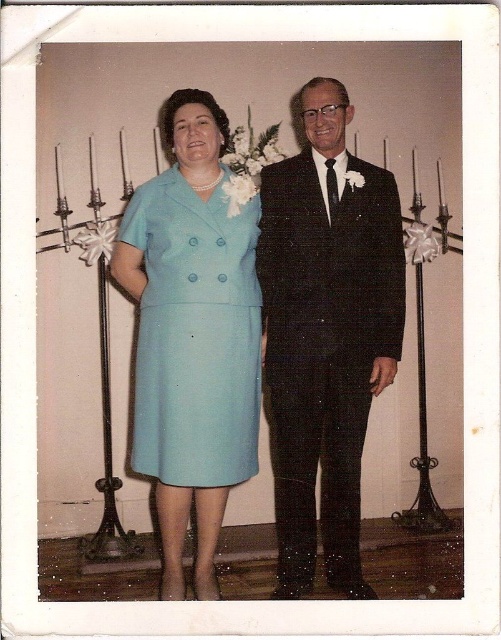
Identify the location of black textured suit at center. The width and height of the screenshot is (501, 640). (326, 333).

Which of these two, black textured suit at center or light blue fabric dress at center, stands shorter?

With less height is light blue fabric dress at center.

Which is in front, point (402, 320) or point (192, 276)?

Point (192, 276) is in front.

Find the location of a particular element. This screenshot has width=501, height=640. black textured suit at center is located at coordinates (326, 333).